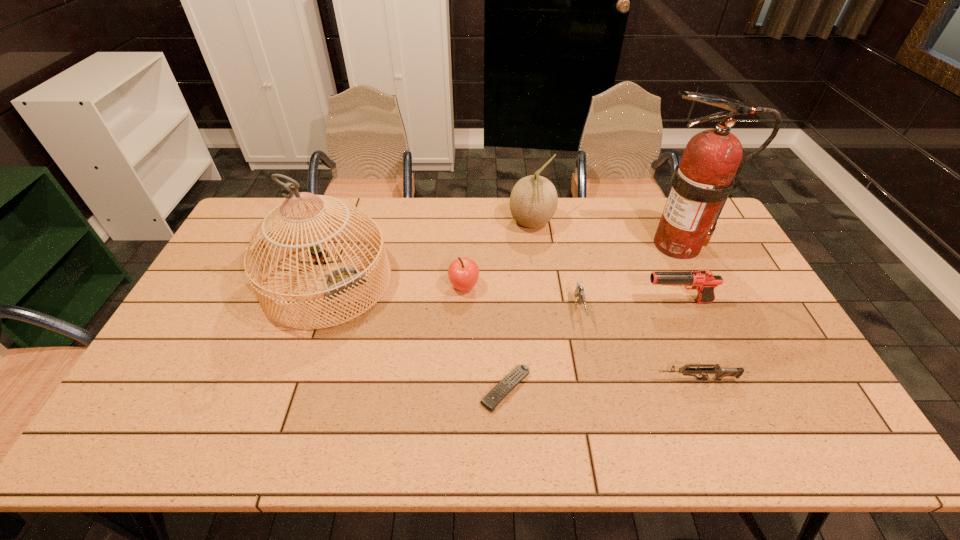
The width and height of the screenshot is (960, 540). Identify the location of the tallest object. (709, 169).

Image resolution: width=960 pixels, height=540 pixels. What are the coordinates of `birdcage` in the screenshot? It's located at (335, 281).

The height and width of the screenshot is (540, 960). In order to click on the seventh shortest object in this screenshot , I will do `click(335, 281)`.

Find the location of a particular element. This screenshot has height=540, width=960. the sixth shortest object is located at coordinates (533, 201).

Locate an element on the screen. This screenshot has width=960, height=540. the tallest gun is located at coordinates (703, 281).

Locate an element on the screen. Image resolution: width=960 pixels, height=540 pixels. apple is located at coordinates (463, 273).

This screenshot has width=960, height=540. I want to click on the fourth object from right to left, so click(579, 292).

Locate an element on the screen. This screenshot has width=960, height=540. the nearest gun is located at coordinates (719, 372).

Locate an element on the screen. The image size is (960, 540). the seventh tallest object is located at coordinates (x=719, y=372).

Find the location of a particular element. The image size is (960, 540). the shortest object is located at coordinates (499, 392).